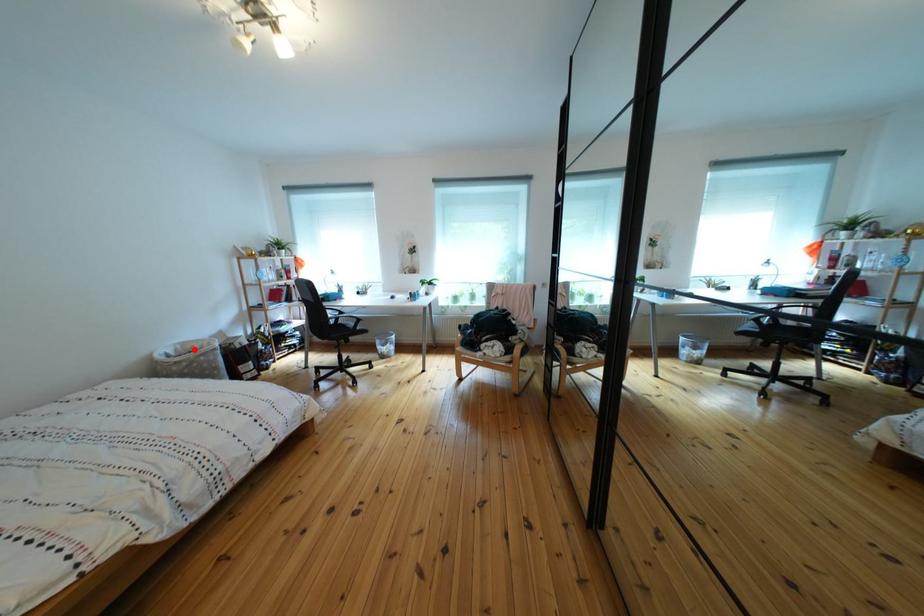
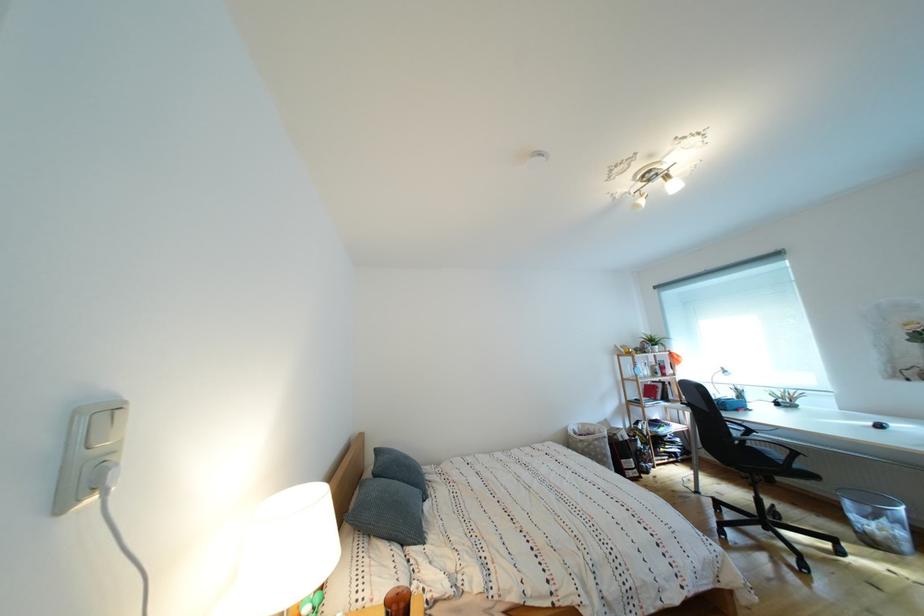
Where in the second image is the point corresponding to the highlighted location from the first image?

(594, 430)